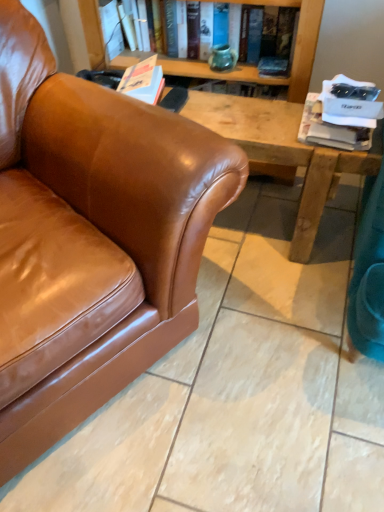
Question: Does matte green vase at upper center, arranged as the second book when ordered from the bottom, have a lesser width compared to white paper at upper right, the 1th book viewed from the right?

Choices:
 (A) yes
 (B) no

Answer: (A)

Question: Is the surface of matte green vase at upper center, arranged as the second book when ordered from the bottom, in direct contact with white paper at upper right, placed as the 2th book when sorted from top to bottom?

Choices:
 (A) yes
 (B) no

Answer: (B)

Question: Is matte green vase at upper center, which is counted as the 2th book, starting from the front, completely or partially outside of white paper at upper right, which is counted as the first book, starting from the bottom?

Choices:
 (A) no
 (B) yes

Answer: (B)

Question: Can you confirm if matte green vase at upper center, which is counted as the 2th book, starting from the front, is taller than white paper at upper right, placed as the 2th book when sorted from top to bottom?

Choices:
 (A) no
 (B) yes

Answer: (B)

Question: Does matte green vase at upper center, positioned as the 1th book in left-to-right order, appear on the right side of white paper at upper right, marked as the 2th book in a back-to-front arrangement?

Choices:
 (A) yes
 (B) no

Answer: (B)

Question: Is point (200, 74) positioned closer to the camera than point (178, 202)?

Choices:
 (A) closer
 (B) farther

Answer: (B)

Question: Considering the positions of matte green vase at upper center, positioned as the 1th book in left-to-right order, and brown leather couch at left in the image, is matte green vase at upper center, positioned as the 1th book in left-to-right order, wider or thinner than brown leather couch at left?

Choices:
 (A) thin
 (B) wide

Answer: (A)

Question: From the image's perspective, is matte green vase at upper center, positioned as the 1th book in left-to-right order, located above or below brown leather couch at left?

Choices:
 (A) below
 (B) above

Answer: (B)

Question: Is matte green vase at upper center, positioned as the 1th book in left-to-right order, to the left or to the right of brown leather couch at left in the image?

Choices:
 (A) left
 (B) right

Answer: (B)

Question: Which is correct: brown leather couch at left is inside matte green vase at upper center, which is counted as the 2th book, starting from the front, or outside of it?

Choices:
 (A) outside
 (B) inside

Answer: (A)

Question: From their relative heights in the image, would you say brown leather couch at left is taller or shorter than matte green vase at upper center, the second book positioned from the right?

Choices:
 (A) tall
 (B) short

Answer: (A)

Question: From the image's perspective, is brown leather couch at left positioned above or below matte green vase at upper center, positioned as the 1th book in left-to-right order?

Choices:
 (A) above
 (B) below

Answer: (B)

Question: Is brown leather couch at left in front of or behind matte green vase at upper center, which is counted as the 2th book, starting from the front, in the image?

Choices:
 (A) behind
 (B) front

Answer: (B)

Question: Considering the positions of brown leather couch at left and white paper at upper right, marked as the 2th book in a back-to-front arrangement, in the image, is brown leather couch at left wider or thinner than white paper at upper right, marked as the 2th book in a back-to-front arrangement,?

Choices:
 (A) wide
 (B) thin

Answer: (A)

Question: From a real-world perspective, is brown leather couch at left physically located above or below white paper at upper right, the 1th book in the front-to-back sequence?

Choices:
 (A) below
 (B) above

Answer: (B)